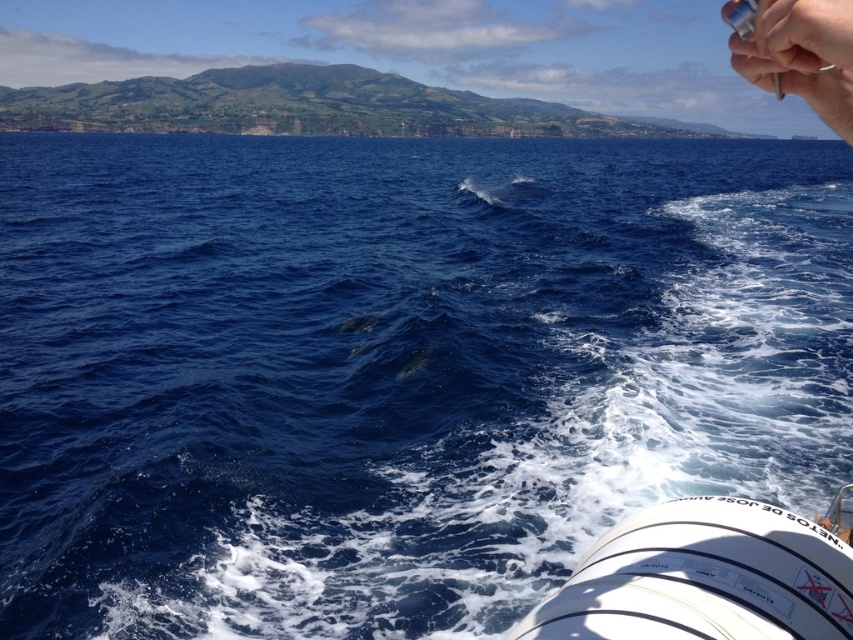
In the scene shown: Can you confirm if white glossy boat at lower right is taller than metallic pen at upper right?

In fact, white glossy boat at lower right may be shorter than metallic pen at upper right.

Can you confirm if white glossy boat at lower right is positioned to the right of metallic pen at upper right?

No, white glossy boat at lower right is not to the right of metallic pen at upper right.

What do you see at coordinates (708, 576) in the screenshot? This screenshot has height=640, width=853. I see `white glossy boat at lower right` at bounding box center [708, 576].

Locate an element on the screen. The height and width of the screenshot is (640, 853). white glossy boat at lower right is located at coordinates (708, 576).